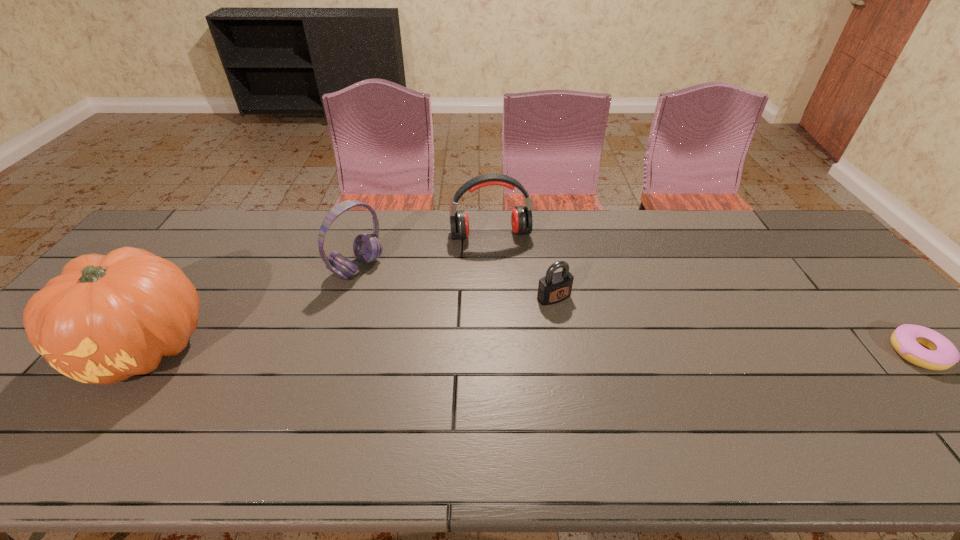
Identify the location of free region located 0.250m on the ear cups of the earphone. This screenshot has height=540, width=960. (510, 300).

I want to click on vacant space situated 0.360m on the headband and ear cups of the headset, so click(470, 335).

Where is `vacant space located 0.350m on the headband and ear cups of the headset`? The width and height of the screenshot is (960, 540). vacant space located 0.350m on the headband and ear cups of the headset is located at coordinates (468, 333).

Find the location of a particular element. The height and width of the screenshot is (540, 960). free region located 0.130m on the headband and ear cups of the headset is located at coordinates (406, 298).

This screenshot has width=960, height=540. I want to click on earphone present at the far edge, so click(x=521, y=218).

This screenshot has width=960, height=540. Identify the location of headset at the far edge. (367, 247).

Where is `object that is at the near edge`? object that is at the near edge is located at coordinates (105, 319).

This screenshot has height=540, width=960. I want to click on object present at the left edge, so click(x=105, y=319).

Where is `object located in the near left corner section of the desktop`? The height and width of the screenshot is (540, 960). object located in the near left corner section of the desktop is located at coordinates (105, 319).

Locate an element on the screen. This screenshot has height=540, width=960. free region at the far edge of the desktop is located at coordinates (337, 223).